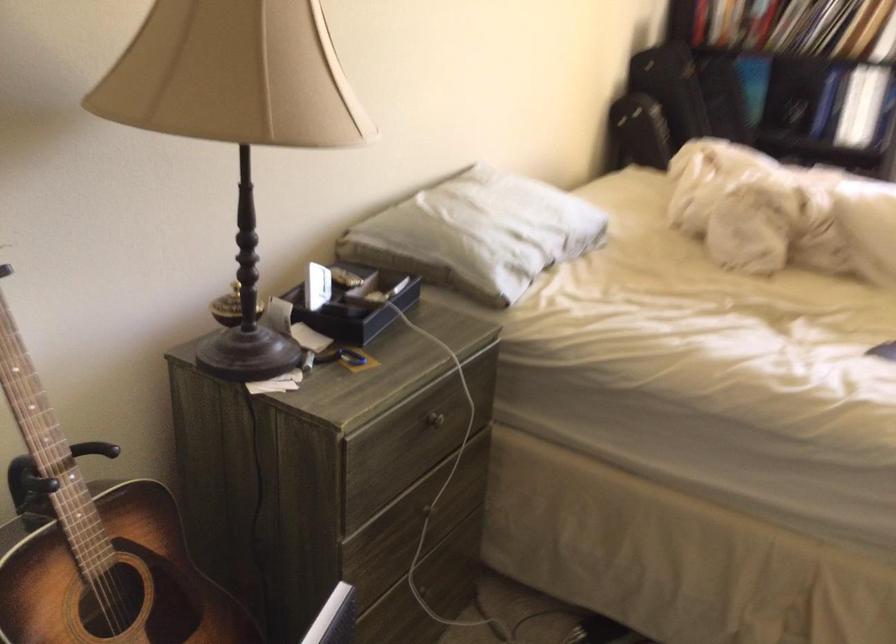
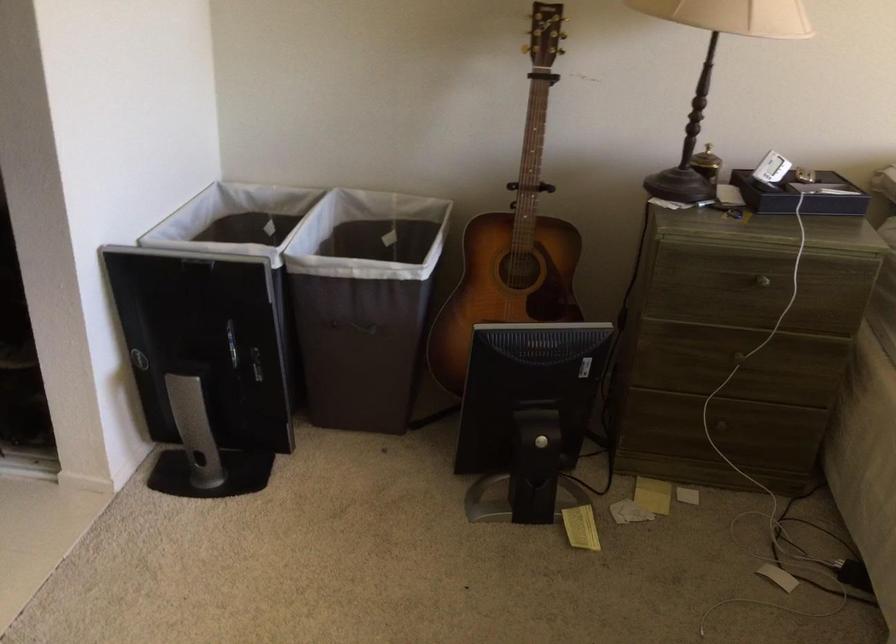
The point at (x=375, y=307) is marked in the first image. Where is the corresponding point in the second image?

(800, 194)